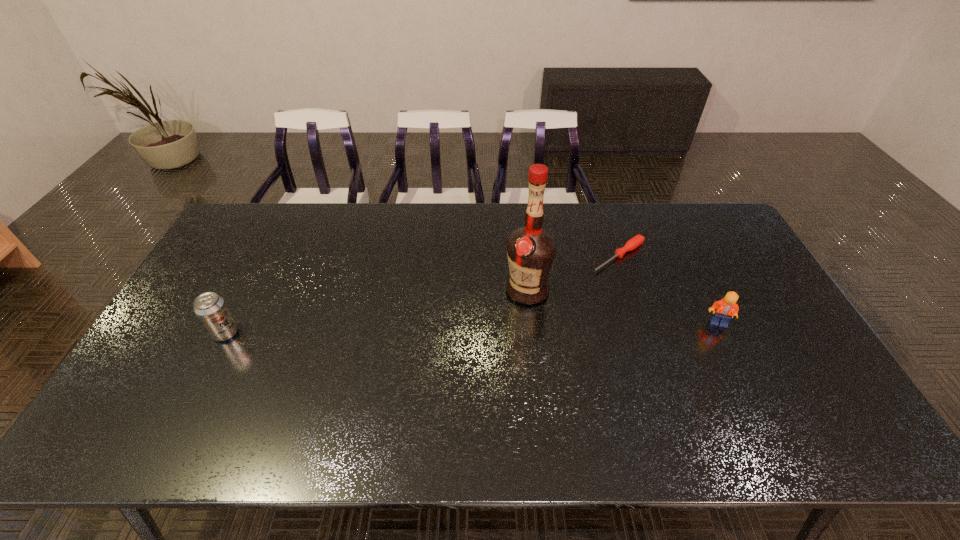
Identify the location of vacant space situated on the front and back of the third object from right to left. (484, 312).

Locate an element on the screen. free region located 0.300m at the tip of the second object from right to left is located at coordinates (534, 313).

Image resolution: width=960 pixels, height=540 pixels. I want to click on vacant space positioned at the tip of the second object from right to left, so click(541, 308).

Where is `blank space located at the tip of the second object from right to left`? This screenshot has width=960, height=540. blank space located at the tip of the second object from right to left is located at coordinates (570, 288).

What are the coordinates of `object at the far edge` in the screenshot? It's located at (633, 243).

Find the location of a particular element. The width and height of the screenshot is (960, 540). object located in the left edge section of the desktop is located at coordinates pos(211,309).

The image size is (960, 540). In order to click on object at the right edge in this screenshot , I will do click(x=726, y=308).

Find the location of `free space at the far edge of the desktop`. free space at the far edge of the desktop is located at coordinates (320, 237).

In the image, there is a desktop. Where is `vacant region at the near edge`? This screenshot has height=540, width=960. vacant region at the near edge is located at coordinates (690, 400).

In order to click on free space at the right edge of the desktop in this screenshot , I will do `click(728, 271)`.